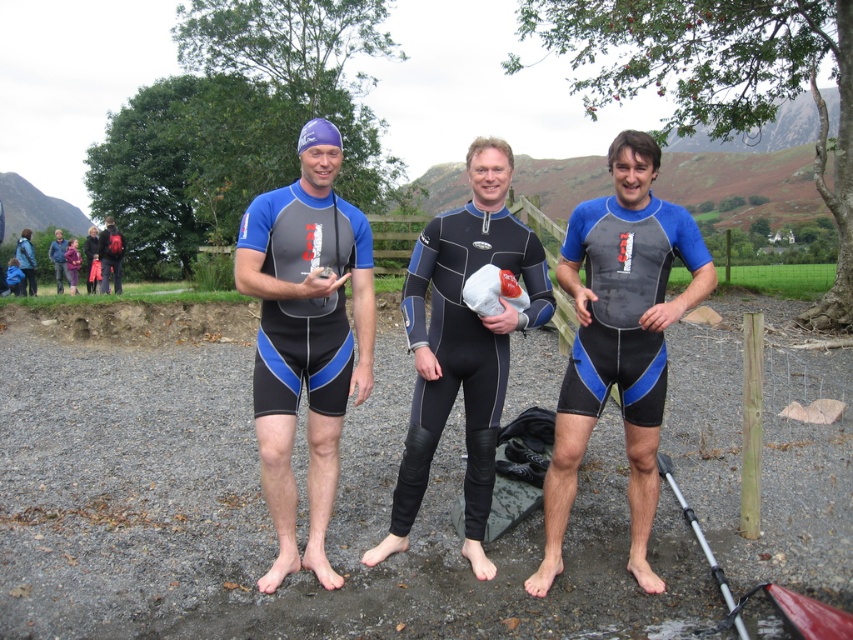
Is matte black wetsuit at left above matte black wetsuit at center?

Correct, matte black wetsuit at left is located above matte black wetsuit at center.

Is point (285, 568) positioned behind point (625, 294)?

Yes, it is.

Is point (351, 365) closer to viewer compared to point (532, 577)?

That is False.

At what (x,y) coordinates should I click in order to perform the action: click on matte black wetsuit at left. Please return your answer as a coordinate pair (x, y). This screenshot has width=853, height=640. Looking at the image, I should click on (305, 337).

Is the position of matte black wetsuit at center more distant than that of dark blue neoprene wetsuit at center?

No, it is in front of dark blue neoprene wetsuit at center.

Which is in front, point (614, 300) or point (422, 317)?

Point (614, 300) is more forward.

This screenshot has width=853, height=640. I want to click on matte black wetsuit at center, so click(x=619, y=339).

Identify the location of matte black wetsuit at center. This screenshot has width=853, height=640. (619, 339).

Can you confirm if matte black wetsuit at left is positioned above dark blue neoprene wetsuit at center?

Indeed, matte black wetsuit at left is positioned over dark blue neoprene wetsuit at center.

This screenshot has height=640, width=853. What do you see at coordinates (305, 337) in the screenshot?
I see `matte black wetsuit at left` at bounding box center [305, 337].

You are a GUI agent. You are given a task and a screenshot of the screen. Output one action in this format:
    pyautogui.click(x=<x>, y=<y>)
    Task: Click on the matte black wetsuit at left
    
    Given the screenshot: What is the action you would take?
    pyautogui.click(x=305, y=337)